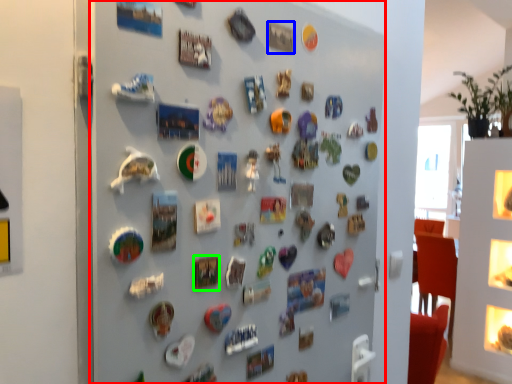
Question: Which is nearer to the fireplace (highlighted by a red box)? button (highlighted by a blue box) or button (highlighted by a green box).

Choices:
 (A) button
 (B) button

Answer: (B)